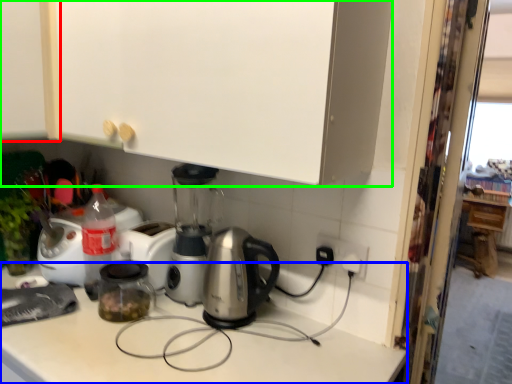
Question: Which object is the closest to the cabinetry (highlighted by a red box)? Choose among these: counter top (highlighted by a blue box) or cabinetry (highlighted by a green box).

Choices:
 (A) counter top
 (B) cabinetry

Answer: (B)